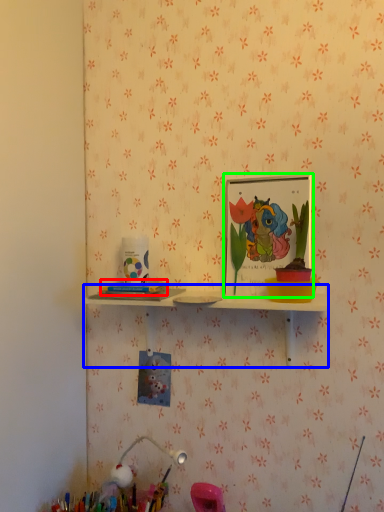
Question: Estimate the real-world distances between objects in this image. Which object is farther from stationery (highlighted by a red box), shelf (highlighted by a blue box) or picture frame (highlighted by a green box)?

Choices:
 (A) shelf
 (B) picture frame

Answer: (B)